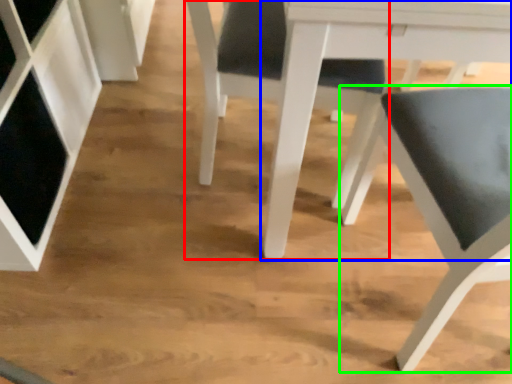
Question: Considering the real-world distances, which object is closest to chair (highlighted by a red box)? table (highlighted by a blue box) or chair (highlighted by a green box).

Choices:
 (A) table
 (B) chair

Answer: (A)